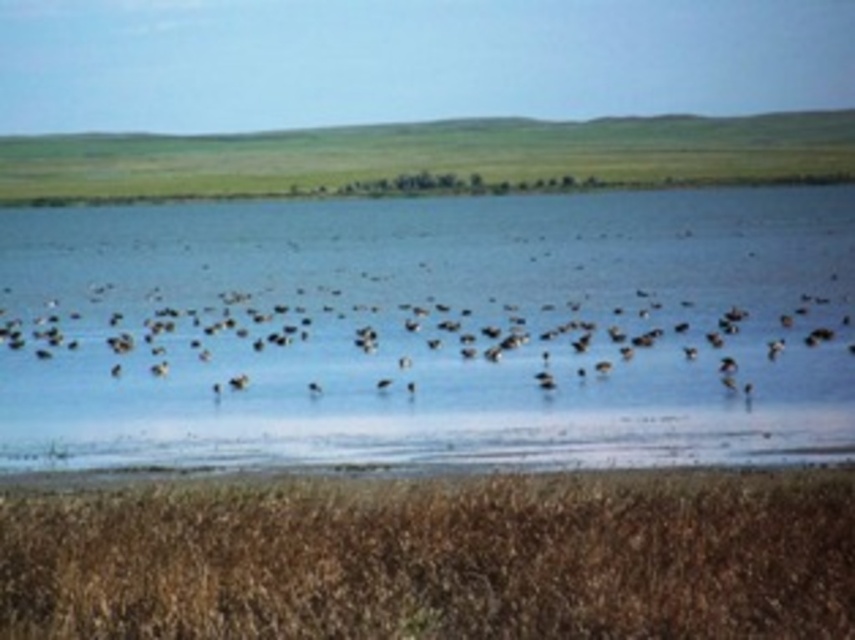
Can you confirm if brown grass at lower center is taller than brown matte birds at center?

Incorrect, brown grass at lower center's height is not larger of brown matte birds at center's.

Who is positioned more to the right, brown grass at lower center or brown matte birds at center?

brown grass at lower center is more to the right.

Is point (612, 472) positioned before point (388, 353)?

That is True.

Image resolution: width=855 pixels, height=640 pixels. In order to click on brown grass at lower center in this screenshot , I will do `click(435, 556)`.

You are a GUI agent. You are given a task and a screenshot of the screen. Output one action in this format:
    pyautogui.click(x=<x>, y=<y>)
    Task: Click on the clear blue water at center
    Image resolution: width=855 pixels, height=640 pixels.
    Given the screenshot: What is the action you would take?
    pyautogui.click(x=429, y=330)

Between clear blue water at center and brown grass at lower center, which one has more height?

clear blue water at center is taller.

Which is behind, point (770, 422) or point (829, 540)?

Point (770, 422)

I want to click on clear blue water at center, so click(x=429, y=330).

Consider the image. Does clear blue water at center appear over brown matte birds at center?

Indeed, clear blue water at center is positioned over brown matte birds at center.

Who is more forward, (753, 269) or (111, 300)?

Point (111, 300) is in front.

Where is `clear blue water at center`? This screenshot has width=855, height=640. clear blue water at center is located at coordinates (429, 330).

You are a GUI agent. You are given a task and a screenshot of the screen. Output one action in this format:
    pyautogui.click(x=<x>, y=<y>)
    Task: Click on the clear blue water at center
    The image size is (855, 640).
    Given the screenshot: What is the action you would take?
    pyautogui.click(x=429, y=330)